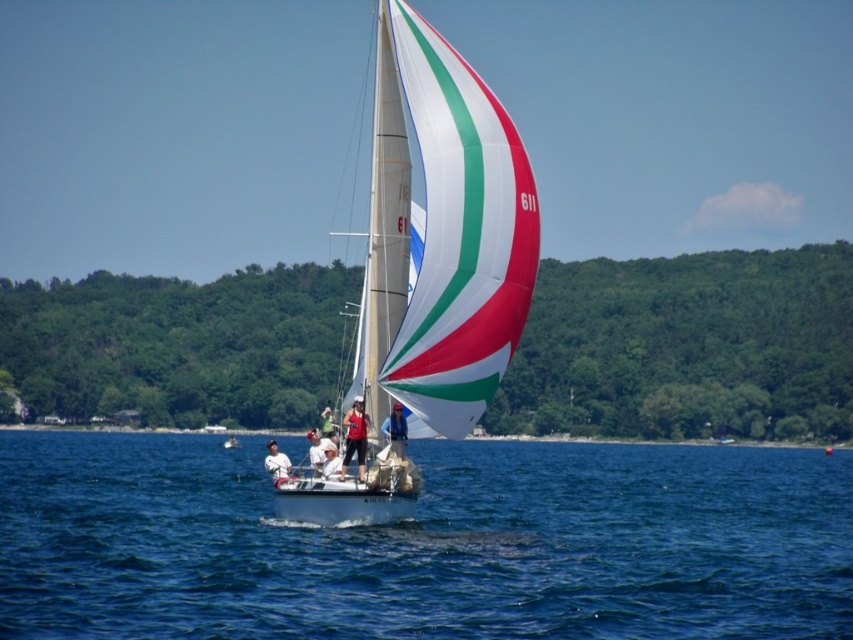
You are a photographer taking a picture of the sailboat. You notice a point at coordinate (355, 436). What object is located at that point?

The point at coordinate (355, 436) corresponds to the matte red tank top at center.

You are standing on the deck of the sailboat and want to know what is located at the coordinates point (425, 545). What would you find there?

At point (425, 545), you would find blue water at center.

You are a photographer trying to capture the white glossy sailboat at center. Based on the coordinates provided, where should you position your camera to ensure the sailboat is centered in your shot?

The white glossy sailboat at center is located at coordinates point (447,234), so you should position your camera to aim directly at that point to center the sailboat in your shot.